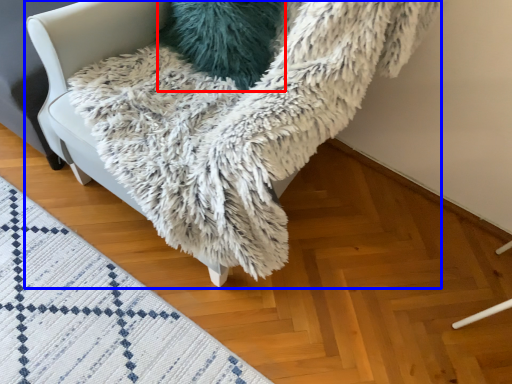
Question: Which point is closer to the camera, pillow (highlighted by a red box) or furniture (highlighted by a blue box)?

Choices:
 (A) pillow
 (B) furniture

Answer: (B)